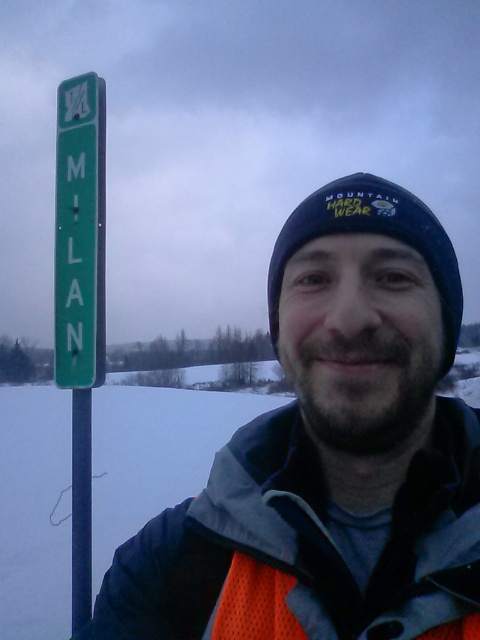
Question: Considering the real-world distances, which object is closest to the matte black beanie at upper center?

Choices:
 (A) green plastic sign at left
 (B) orange mesh vest at center

Answer: (B)

Question: Is matte black beanie at upper center to the left of green plastic sign at left from the viewer's perspective?

Choices:
 (A) no
 (B) yes

Answer: (A)

Question: Is matte black beanie at upper center thinner than orange mesh vest at center?

Choices:
 (A) yes
 (B) no

Answer: (B)

Question: Which of the following is the farthest from the observer?

Choices:
 (A) (75, 353)
 (B) (230, 593)

Answer: (A)

Question: Which is farther from the green plastic sign at left?

Choices:
 (A) orange mesh vest at center
 (B) matte black beanie at upper center

Answer: (A)

Question: Does matte black beanie at upper center lie in front of green plastic sign at left?

Choices:
 (A) no
 (B) yes

Answer: (B)